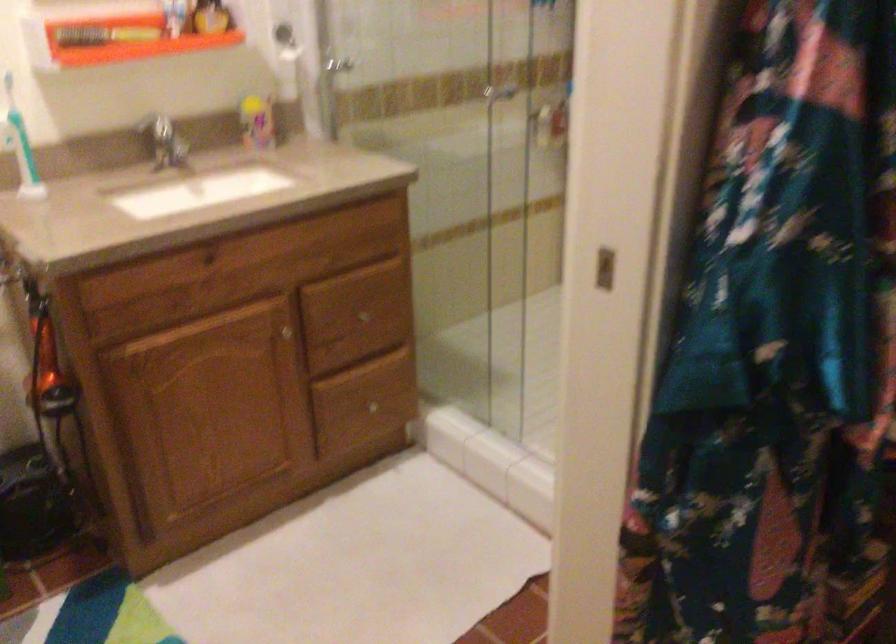
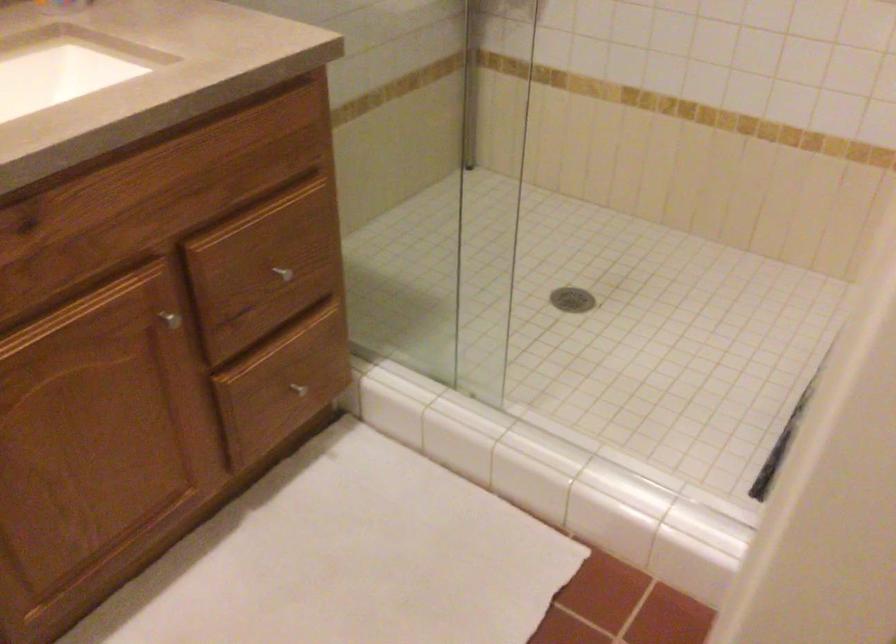
Locate, in the second image, the point that corresponds to pixel 371 409 in the first image.

(297, 389)